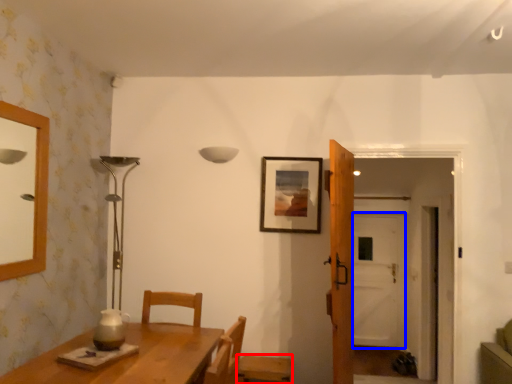
Question: Which of the following is the closest to the observer, chair (highlighted by a red box) or glass door (highlighted by a blue box)?

Choices:
 (A) chair
 (B) glass door

Answer: (A)